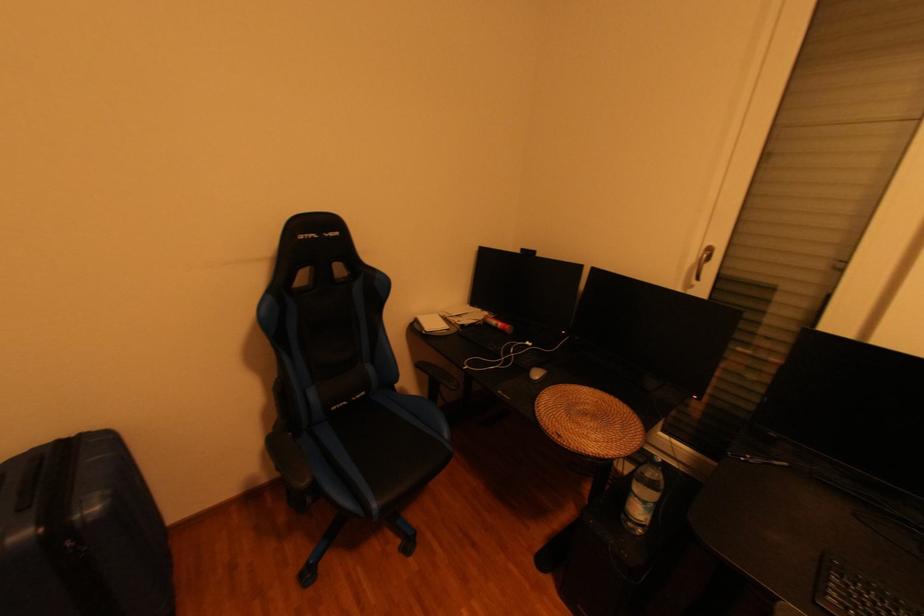
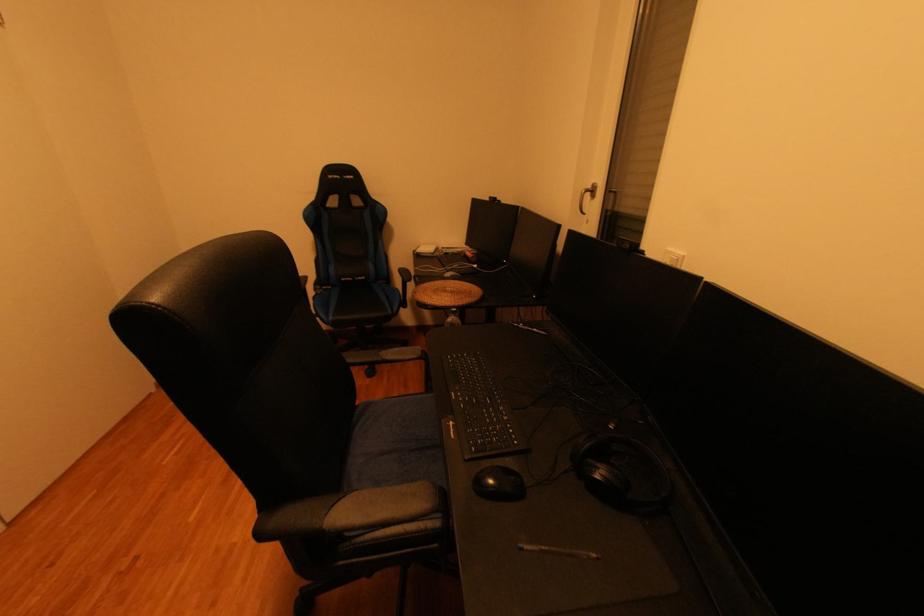
Question: Which direction would the cameraman need to move to produce the second image? Reply with the corresponding letter.

Choices:
 (A) Left
 (B) Right
 (C) Forward
 (D) Backward

Answer: (B)